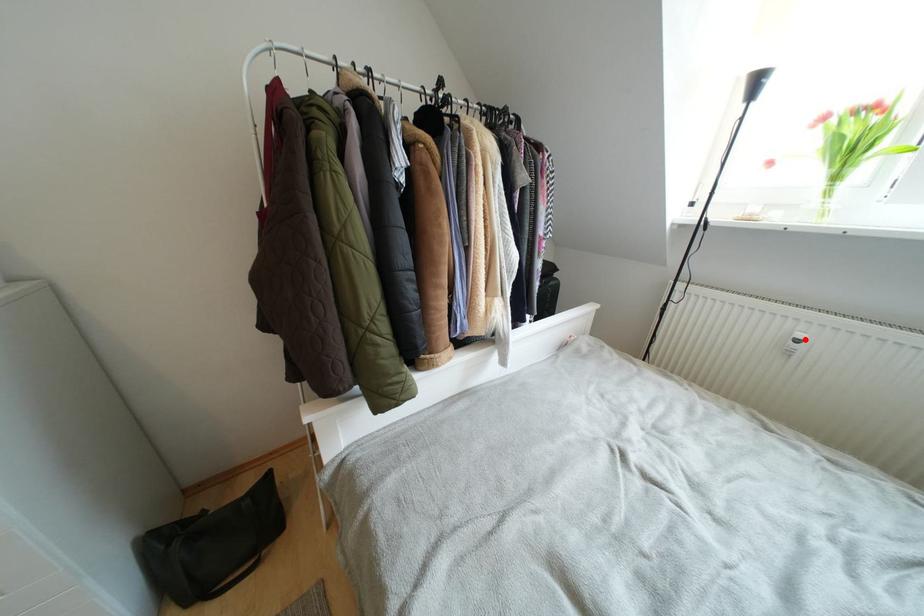
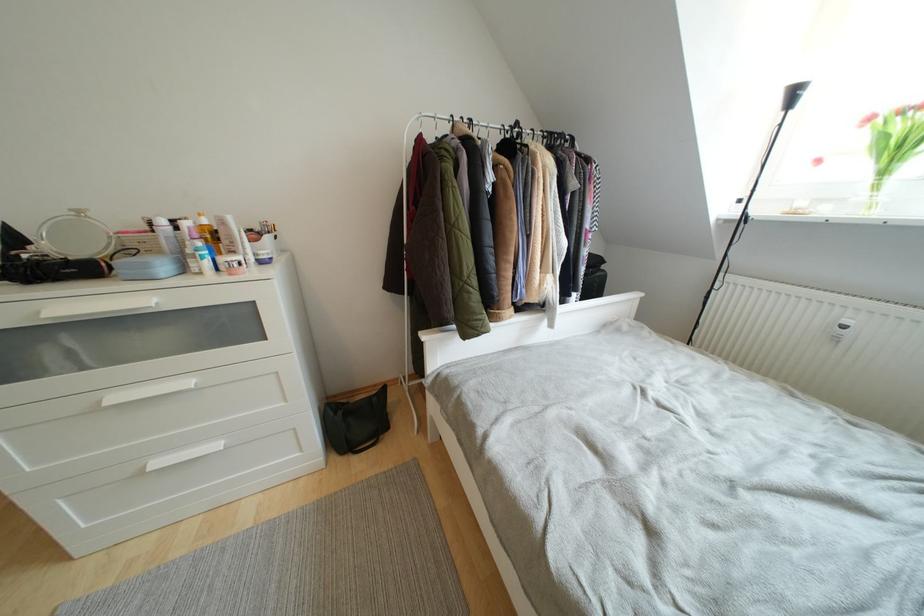
In the second image, find the point that corresponds to the highlighted location in the first image.

(853, 326)